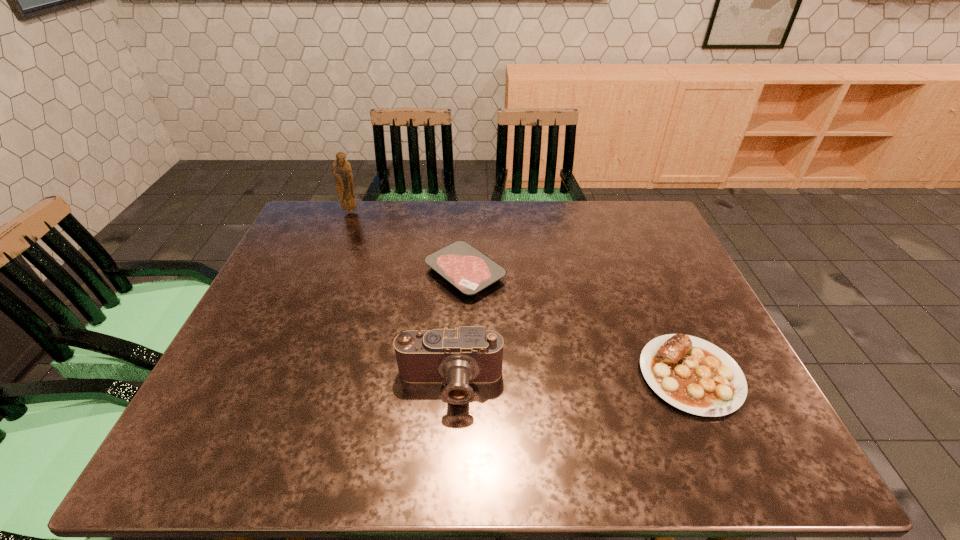
You are a GUI agent. You are given a task and a screenshot of the screen. Output one action in this format:
    pyautogui.click(x=<x>, y=<y>)
    Task: Click on the farthest object
    Image resolution: width=960 pixels, height=540 pixels.
    Given the screenshot: What is the action you would take?
    pyautogui.click(x=341, y=169)

Identify the location of the leftmost object. Image resolution: width=960 pixels, height=540 pixels. (341, 169).

The height and width of the screenshot is (540, 960). Identify the location of camera. (457, 357).

The image size is (960, 540). What are the coordinates of `the right steak` in the screenshot? It's located at (692, 374).

Identify the location of the taller steak. This screenshot has width=960, height=540. (x=692, y=374).

The image size is (960, 540). Find the location of `the farther steak`. the farther steak is located at coordinates (469, 270).

Locate an element on the screen. The image size is (960, 540). the left steak is located at coordinates (469, 270).

Where is `free location located on the front-facing side of the leftmost object`? This screenshot has width=960, height=540. free location located on the front-facing side of the leftmost object is located at coordinates (338, 245).

The image size is (960, 540). Find the location of `vacant region located on the front-facing side of the second tallest object`. vacant region located on the front-facing side of the second tallest object is located at coordinates (446, 438).

Find the location of `vacant space located 0.190m on the left of the left steak`. vacant space located 0.190m on the left of the left steak is located at coordinates (356, 273).